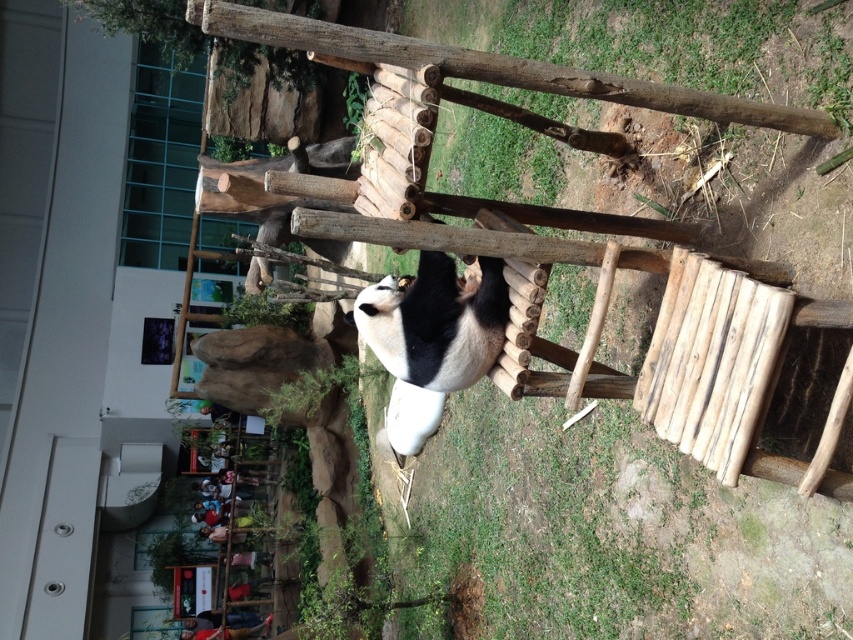
You are a zookeeper observing the panda enclosure. You notice the black and white fur at center and the wooden ladder at lower left. Which object is positioned higher in the scene?

The black and white fur at center is above the wooden ladder at lower left, so it is positioned higher in the scene.

You are a zookeeper observing the panda enclosure. You need to determine if the black and white fur at center can fit through the wooden ladder at lower left. Based on the structure of the ladder, can the panda pass through?

The black and white fur at center is thinner than wooden ladder at lower left, so yes, the panda can pass through the wooden ladder at lower left since its fur width is narrower than the ladder gaps.

You are a zookeeper observing the panda in its enclosure. You need to ensure the panda can climb safely. Given the black and white fur at center and the wooden ladder at lower left, which one is shorter in height?

The black and white fur at center is shorter in height than the wooden ladder at lower left.